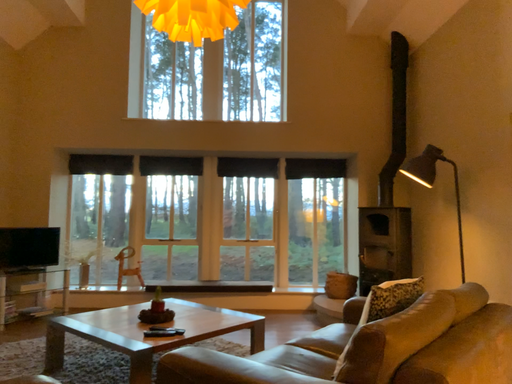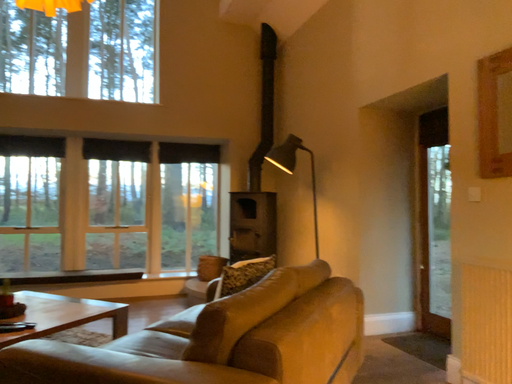
Question: How did the camera likely rotate when shooting the video?

Choices:
 (A) rotated right
 (B) rotated left

Answer: (A)